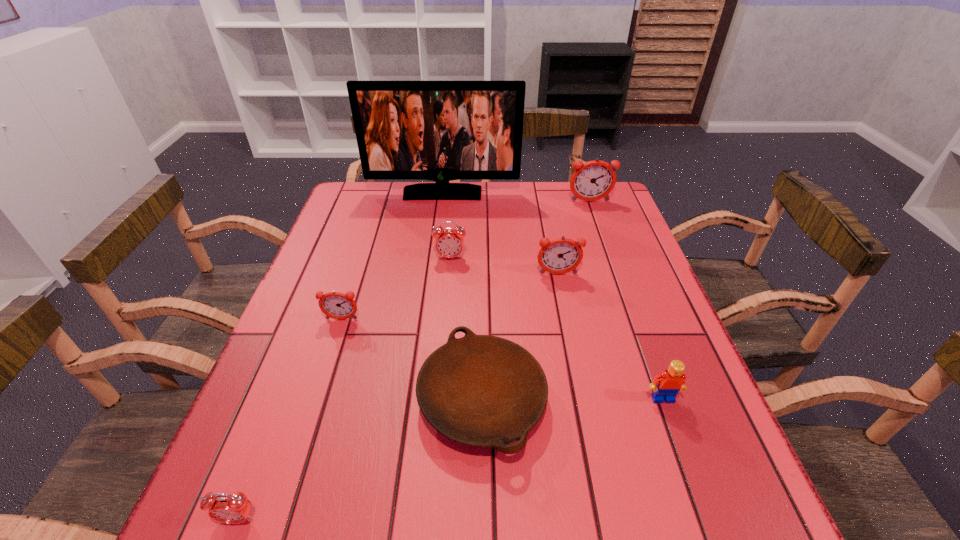
This screenshot has height=540, width=960. In order to click on free location that satisfies the following two spatial constraints: 1. on the front-facing side of the brown plate; 2. on the right side of the tallest object in this screenshot , I will do `click(418, 399)`.